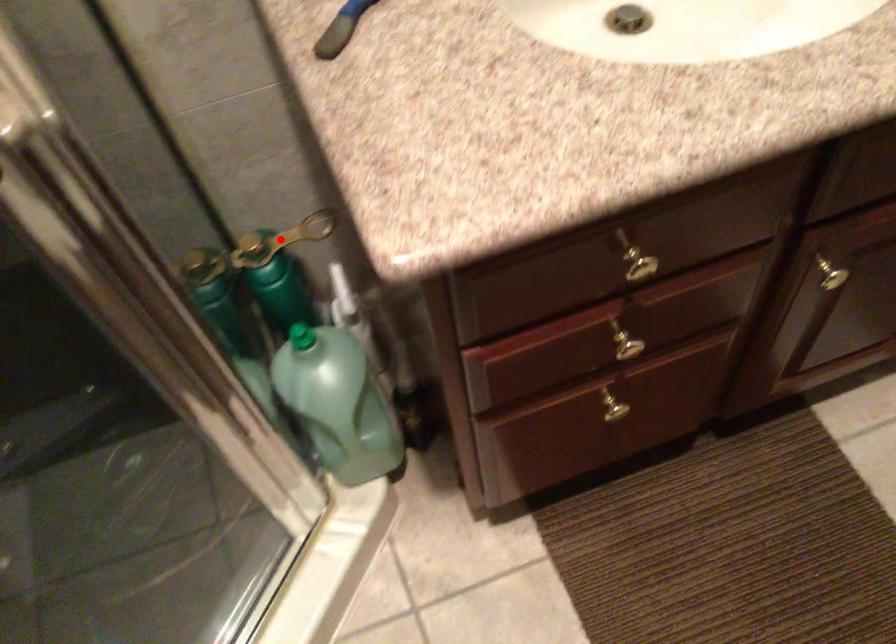
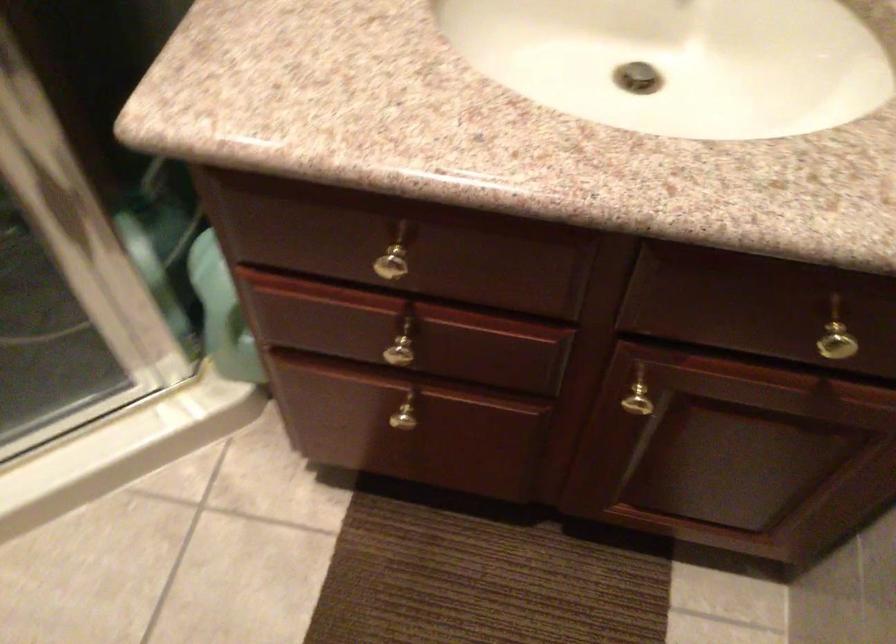
Question: I am providing you with two images of the same scene from different viewpoints. A red point is marked on the first image. Is the red point's position out of view in image 2?

Choices:
 (A) Yes
 (B) No

Answer: (A)